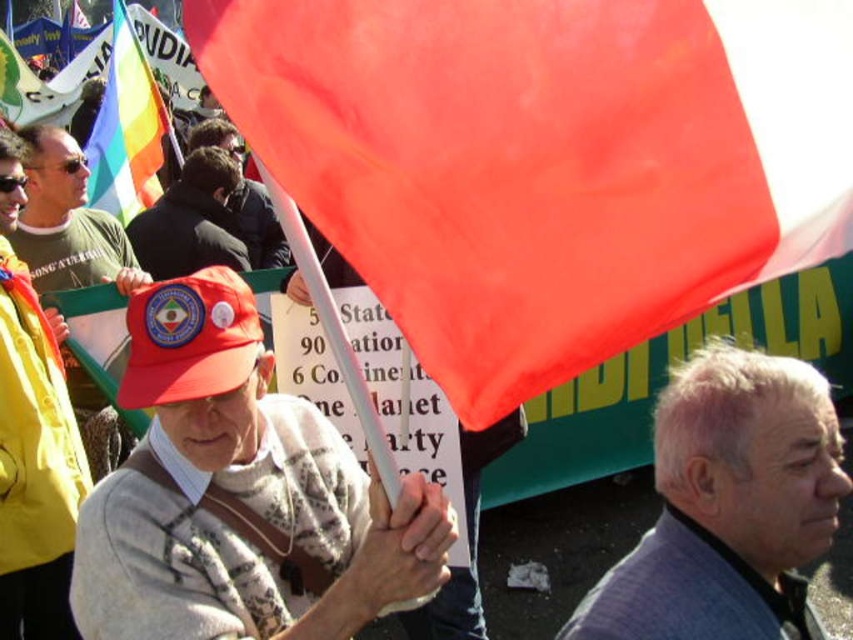
You are a photographer trying to capture both the matte red cap at center and the rainbow fabric flag at upper left in a single frame. Given their sizes, which object should you focus on first to ensure both are visible in the photo?

The matte red cap at center has a smaller size compared to rainbow fabric flag at upper left. To ensure both are visible in the photo, focus on the rainbow fabric flag at upper left first since it is larger and will require more space in the frame, then adjust to include the smaller matte red cap at center.

You are a photographer standing at the center of the scene. You want to take a photo that includes both the point at coordinates point (107, 486) and point (25, 150). Which point should be placed closer to the front of the photo to ensure both are visible?

Point (107, 486) should be placed closer to the front of the photo because it is in front of point (25, 150) according to the spatial description.

You are standing in the crowd at this event and want to take a photo of the point at coordinates (779,472). If your camera has a focal length of 50mm and you need the subject to be in focus at 4.50 meters, what adjustment should you make to the camera settings?

The point at coordinates (779,472) is 4.50 meters away from the viewer. To ensure it is in focus, adjust the camera focus to 4.50 meters.